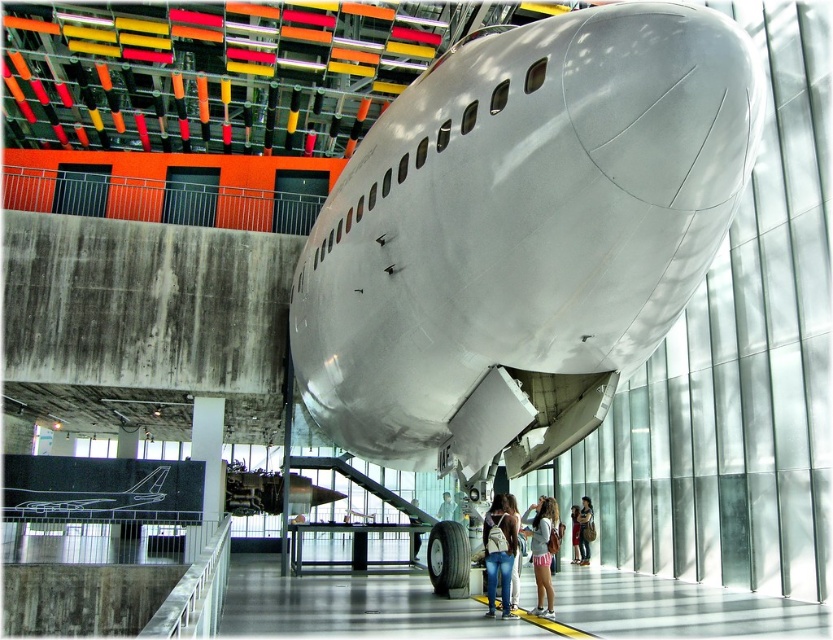
Does denim jacket at lower right have a lesser width compared to denim shorts at center?

Incorrect, denim jacket at lower right's width is not less than denim shorts at center's.

You are a GUI agent. You are given a task and a screenshot of the screen. Output one action in this format:
    pyautogui.click(x=<x>, y=<y>)
    Task: Click on the denim jacket at lower right
    
    Given the screenshot: What is the action you would take?
    pyautogui.click(x=585, y=529)

Does denim jeans at center come in front of pink fabric shorts at lower center?

Yes, denim jeans at center is closer to the viewer.

Does denim jeans at center have a lesser height compared to pink fabric shorts at lower center?

In fact, denim jeans at center may be taller than pink fabric shorts at lower center.

Is point (507, 611) more distant than point (547, 612)?

No, it is not.

Identify the location of denim jeans at center. (497, 552).

Does polished aluminum airplane at center have a larger size compared to pink fabric shorts at lower center?

Yes.

Is point (597, 51) closer to viewer compared to point (537, 525)?

Yes, point (597, 51) is closer to viewer.

Which is behind, point (610, 163) or point (534, 508)?

The point (534, 508) is more distant.

This screenshot has width=833, height=640. I want to click on polished aluminum airplane at center, so click(x=522, y=234).